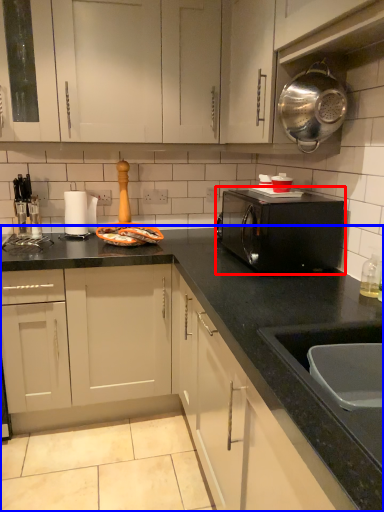
Question: Which of the following is the closest to the observer, home appliance (highlighted by a red box) or countertop (highlighted by a blue box)?

Choices:
 (A) home appliance
 (B) countertop

Answer: (A)